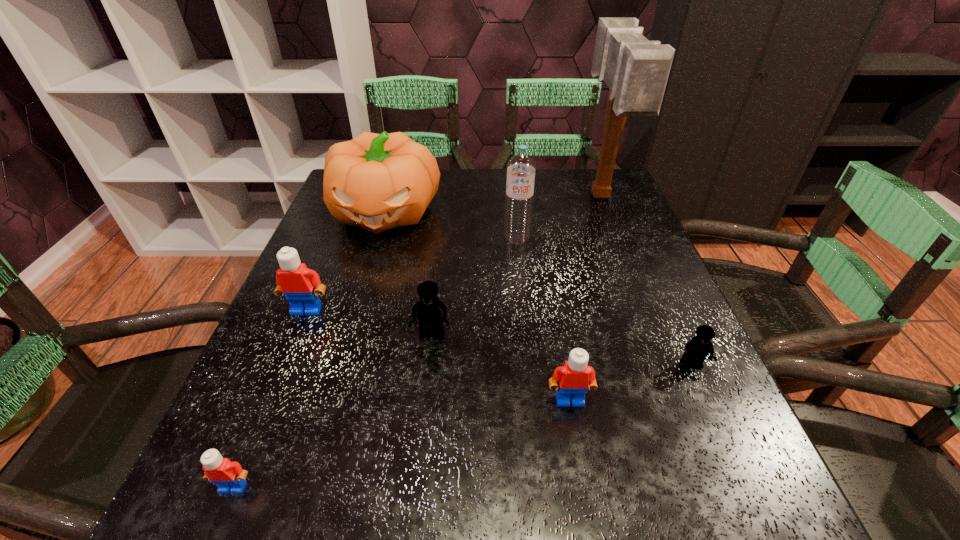
Identify the location of vacant region located 0.120m on the front-facing side of the right yellow Lego. (725, 439).

Find the location of `mallet positioned at the far edge`. mallet positioned at the far edge is located at coordinates (636, 70).

This screenshot has height=540, width=960. I want to click on pumpkin that is at the far edge, so click(375, 181).

Where is `object that is at the near edge`? object that is at the near edge is located at coordinates (229, 476).

Where is `pumpkin that is at the left edge`? The width and height of the screenshot is (960, 540). pumpkin that is at the left edge is located at coordinates (375, 181).

The height and width of the screenshot is (540, 960). What are the coordinates of `mallet at the right edge` in the screenshot? It's located at (636, 70).

Where is `Lego located at the right edge`? Lego located at the right edge is located at coordinates (698, 348).

Locate an element on the screen. object situated at the far left corner is located at coordinates (375, 181).

In order to click on object located at the near left corner in this screenshot , I will do `click(229, 476)`.

Where is `object present at the far right corner`? The image size is (960, 540). object present at the far right corner is located at coordinates tap(636, 70).